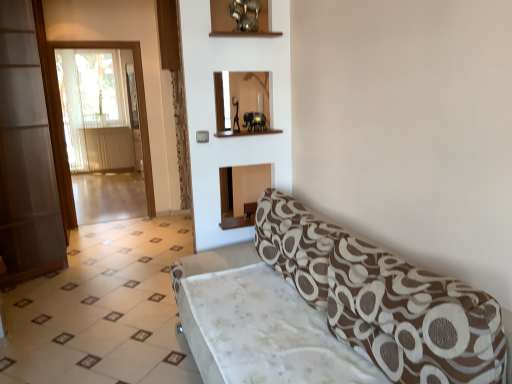
Describe the element at coordinates (137, 101) in the screenshot. The height and width of the screenshot is (384, 512). I see `transparent glass screen door at left, the 2th screen door in the front-to-back sequence` at that location.

Find the location of a particular element. Image resolution: width=512 pixels, height=384 pixels. brown textured fabric studio couch at lower right is located at coordinates (383, 299).

What are the coordinates of `transparent glass screen door at left, the 2th screen door in the front-to-back sequence` in the screenshot? It's located at (137, 101).

Locate an element on the screen. The image size is (512, 384). studio couch above the white glossy tile at lower left (from a real-world perspective) is located at coordinates (383, 299).

Consider the image. Could you tell me if brown textured fabric studio couch at lower right is facing white glossy tile at lower left?

No, brown textured fabric studio couch at lower right is not turned towards white glossy tile at lower left.

In the scene shown: Between brown textured fabric studio couch at lower right and white glossy tile at lower left, which one has larger size?

brown textured fabric studio couch at lower right is bigger.

From the picture: Which of these two, brown textured fabric studio couch at lower right or white glossy tile at lower left, stands shorter?

white glossy tile at lower left is shorter.

From a real-world perspective, relative to brown textured fabric studio couch at lower right, is white glossy tile at lower left vertically above or below?

From a real-world perspective, white glossy tile at lower left is physically below brown textured fabric studio couch at lower right.

Does point (168, 347) come in front of point (303, 280)?

No, (168, 347) is further to viewer.

What's the angular difference between white glossy tile at lower left and brown textured fabric studio couch at lower right's facing directions?

There is a 90-degree angle between the facing directions of white glossy tile at lower left and brown textured fabric studio couch at lower right.

Where is `studio couch that is on the right side of white glossy tile at lower left`? The height and width of the screenshot is (384, 512). studio couch that is on the right side of white glossy tile at lower left is located at coordinates (383, 299).

From the image's perspective, which is above, transparent glass screen door at left, which appears as the 1th screen door when viewed from the front, or brown textured fabric studio couch at lower right?

transparent glass screen door at left, which appears as the 1th screen door when viewed from the front, appears higher in the image.

What's the angular difference between transparent glass screen door at left, placed as the second screen door when sorted from back to front, and brown textured fabric studio couch at lower right's facing directions?

179 degrees separate the facing orientations of transparent glass screen door at left, placed as the second screen door when sorted from back to front, and brown textured fabric studio couch at lower right.

Does transparent glass screen door at left, which appears as the 1th screen door when viewed from the front, have a lesser width compared to brown textured fabric studio couch at lower right?

Correct, the width of transparent glass screen door at left, which appears as the 1th screen door when viewed from the front, is less than that of brown textured fabric studio couch at lower right.

The image size is (512, 384). I want to click on studio couch lying in front of the transparent glass screen door at left, placed as the second screen door when sorted from back to front, so click(383, 299).

Is white glossy tile at lower left placed right next to transparent glass screen door at left, marked as the first screen door in a back-to-front arrangement?

No, white glossy tile at lower left is not next to transparent glass screen door at left, marked as the first screen door in a back-to-front arrangement.

From a real-world perspective, is white glossy tile at lower left positioned above or below transparent glass screen door at left, the 2th screen door in the front-to-back sequence?

Clearly, from a real-world perspective, white glossy tile at lower left is below transparent glass screen door at left, the 2th screen door in the front-to-back sequence.

Considering the sizes of objects white glossy tile at lower left and transparent glass screen door at left, the 2th screen door in the front-to-back sequence, in the image provided, who is shorter, white glossy tile at lower left or transparent glass screen door at left, the 2th screen door in the front-to-back sequence,?

Standing shorter between the two is white glossy tile at lower left.

Based on the photo, from the image's perspective, which one is positioned lower, white glossy tile at lower left or transparent glass screen door at left, the 2th screen door in the front-to-back sequence?

From the image's view, white glossy tile at lower left is below.

Does point (153, 200) come closer to viewer compared to point (32, 314)?

No, it is behind (32, 314).

Is transparent glass screen door at left, marked as the first screen door in a back-to-front arrangement, smaller than white glossy tile at lower left?

Yes, transparent glass screen door at left, marked as the first screen door in a back-to-front arrangement, is smaller than white glossy tile at lower left.

Is transparent glass screen door at left, the 2th screen door in the front-to-back sequence, not within white glossy tile at lower left?

That's correct, transparent glass screen door at left, the 2th screen door in the front-to-back sequence, is outside of white glossy tile at lower left.

From the image's perspective, would you say transparent glass screen door at left, the 2th screen door in the front-to-back sequence, is shown under white glossy tile at lower left?

Incorrect, from the image's perspective, transparent glass screen door at left, the 2th screen door in the front-to-back sequence, is higher than white glossy tile at lower left.

Relative to transparent glass screen door at left, placed as the second screen door when sorted from back to front, is transparent glass screen door at left, the 2th screen door in the front-to-back sequence, in front or behind?

transparent glass screen door at left, the 2th screen door in the front-to-back sequence, is behind transparent glass screen door at left, placed as the second screen door when sorted from back to front.

This screenshot has height=384, width=512. I want to click on screen door lying below the transparent glass screen door at left, the 2th screen door in the front-to-back sequence (from the image's perspective), so click(26, 156).

Is transparent glass screen door at left, marked as the first screen door in a back-to-front arrangement, bigger than transparent glass screen door at left, placed as the second screen door when sorted from back to front?

Actually, transparent glass screen door at left, marked as the first screen door in a back-to-front arrangement, might be smaller than transparent glass screen door at left, placed as the second screen door when sorted from back to front.

Does transparent glass screen door at left, marked as the first screen door in a back-to-front arrangement, have a greater height compared to transparent glass screen door at left, placed as the second screen door when sorted from back to front?

No, transparent glass screen door at left, marked as the first screen door in a back-to-front arrangement, is not taller than transparent glass screen door at left, placed as the second screen door when sorted from back to front.

Does brown textured fabric studio couch at lower right touch transparent glass screen door at left, which appears as the 1th screen door when viewed from the front?

No.

Does brown textured fabric studio couch at lower right lie behind transparent glass screen door at left, which appears as the 1th screen door when viewed from the front?

No, brown textured fabric studio couch at lower right is closer to the viewer.

Is brown textured fabric studio couch at lower right looking in the opposite direction of transparent glass screen door at left, placed as the second screen door when sorted from back to front?

That's not correct — brown textured fabric studio couch at lower right is not looking away from transparent glass screen door at left, placed as the second screen door when sorted from back to front.

Is brown textured fabric studio couch at lower right to the left of transparent glass screen door at left, which appears as the 1th screen door when viewed from the front, from the viewer's perspective?

No, brown textured fabric studio couch at lower right is not to the left of transparent glass screen door at left, which appears as the 1th screen door when viewed from the front.

Locate an element on the screen. This screenshot has width=512, height=384. tile below the brown textured fabric studio couch at lower right (from a real-world perspective) is located at coordinates coord(103,310).

The height and width of the screenshot is (384, 512). In order to click on studio couch above the white glossy tile at lower left (from a real-world perspective) in this screenshot , I will do `click(383, 299)`.

In the scene shown: Which object lies nearer to the anchor point white glossy tile at lower left, brown textured fabric studio couch at lower right or transparent glass screen door at left, the 2th screen door in the front-to-back sequence?

Based on the image, brown textured fabric studio couch at lower right appears to be nearer to white glossy tile at lower left.

Based on their spatial positions, is white glossy tile at lower left or transparent glass screen door at left, marked as the first screen door in a back-to-front arrangement, closer to brown textured fabric studio couch at lower right?

Among the two, white glossy tile at lower left is located nearer to brown textured fabric studio couch at lower right.

Which object lies nearer to the anchor point transparent glass screen door at left, which appears as the 1th screen door when viewed from the front, brown textured fabric studio couch at lower right or white glossy tile at lower left?

Among the two, white glossy tile at lower left is located nearer to transparent glass screen door at left, which appears as the 1th screen door when viewed from the front.

From the picture: Considering their positions, is white glossy tile at lower left positioned further to transparent glass screen door at left, placed as the second screen door when sorted from back to front, than brown textured fabric studio couch at lower right?

brown textured fabric studio couch at lower right is positioned further to the anchor transparent glass screen door at left, placed as the second screen door when sorted from back to front.

Estimate the real-world distances between objects in this image. Which object is closer to white glossy tile at lower left, transparent glass screen door at left, placed as the second screen door when sorted from back to front, or brown textured fabric studio couch at lower right?

The object closer to white glossy tile at lower left is transparent glass screen door at left, placed as the second screen door when sorted from back to front.

Which object lies further to the anchor point transparent glass screen door at left, placed as the second screen door when sorted from back to front, white glossy tile at lower left or transparent glass screen door at left, marked as the first screen door in a back-to-front arrangement?

transparent glass screen door at left, marked as the first screen door in a back-to-front arrangement, is positioned further to the anchor transparent glass screen door at left, placed as the second screen door when sorted from back to front.

Looking at the image, which one is located further to transparent glass screen door at left, which appears as the 1th screen door when viewed from the front, transparent glass screen door at left, the 2th screen door in the front-to-back sequence, or white glossy tile at lower left?

Among the two, transparent glass screen door at left, the 2th screen door in the front-to-back sequence, is located further to transparent glass screen door at left, which appears as the 1th screen door when viewed from the front.

Estimate the real-world distances between objects in this image. Which object is further from transparent glass screen door at left, the 2th screen door in the front-to-back sequence, brown textured fabric studio couch at lower right or white glossy tile at lower left?

brown textured fabric studio couch at lower right is positioned further to the anchor transparent glass screen door at left, the 2th screen door in the front-to-back sequence.

Where is `tile between brown textured fabric studio couch at lower right and transparent glass screen door at left, marked as the first screen door in a back-to-front arrangement, from front to back`? tile between brown textured fabric studio couch at lower right and transparent glass screen door at left, marked as the first screen door in a back-to-front arrangement, from front to back is located at coordinates (103, 310).

Where is `screen door between white glossy tile at lower left and transparent glass screen door at left, the 2th screen door in the front-to-back sequence, in the front-back direction`? screen door between white glossy tile at lower left and transparent glass screen door at left, the 2th screen door in the front-to-back sequence, in the front-back direction is located at coordinates (26, 156).

Identify the location of screen door positioned between brown textured fabric studio couch at lower right and transparent glass screen door at left, the 2th screen door in the front-to-back sequence, from near to far. The image size is (512, 384). (26, 156).

Locate an element on the screen. The height and width of the screenshot is (384, 512). tile between transparent glass screen door at left, placed as the second screen door when sorted from back to front, and brown textured fabric studio couch at lower right from left to right is located at coordinates (103, 310).